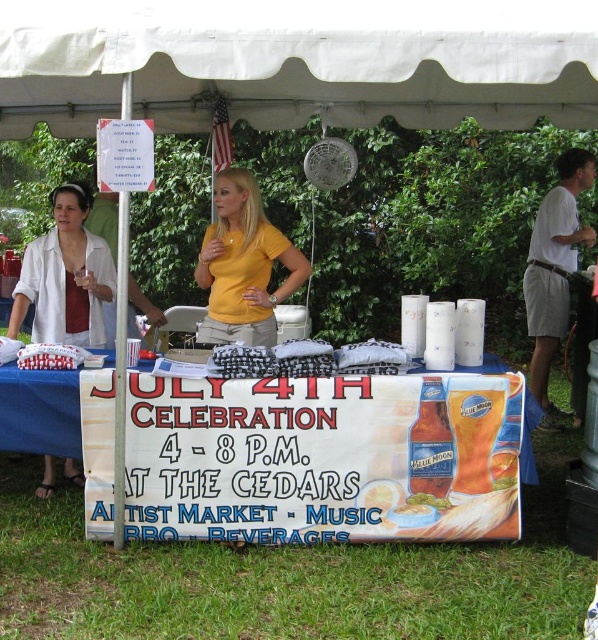
Who is more forward, (124, 42) or (80, 291)?

Point (124, 42)

Is point (532, 74) behind point (44, 330)?

No, (532, 74) is in front of (44, 330).

What are the coordinates of `white fabric canopy at upper center` in the screenshot? It's located at (297, 61).

Between white fabric canopy at upper center and blue paperboard sign at center, which one is positioned higher?

Positioned higher is white fabric canopy at upper center.

Describe the element at coordinates (297, 61) in the screenshot. I see `white fabric canopy at upper center` at that location.

The height and width of the screenshot is (640, 598). Identify the location of white fabric canopy at upper center. (297, 61).

Who is more distant from viewer, (x=309, y=451) or (x=78, y=236)?

Positioned behind is point (x=78, y=236).

Does blue paperboard sign at center appear over matte white blouse at left?

Actually, blue paperboard sign at center is below matte white blouse at left.

Who is more distant from viewer, [340,422] or [83,312]?

Positioned behind is point [83,312].

At what (x,y) coordinates should I click in order to perform the action: click on blue paperboard sign at center. Please return your answer as a coordinate pair (x, y). The image size is (598, 640). Looking at the image, I should click on (312, 451).